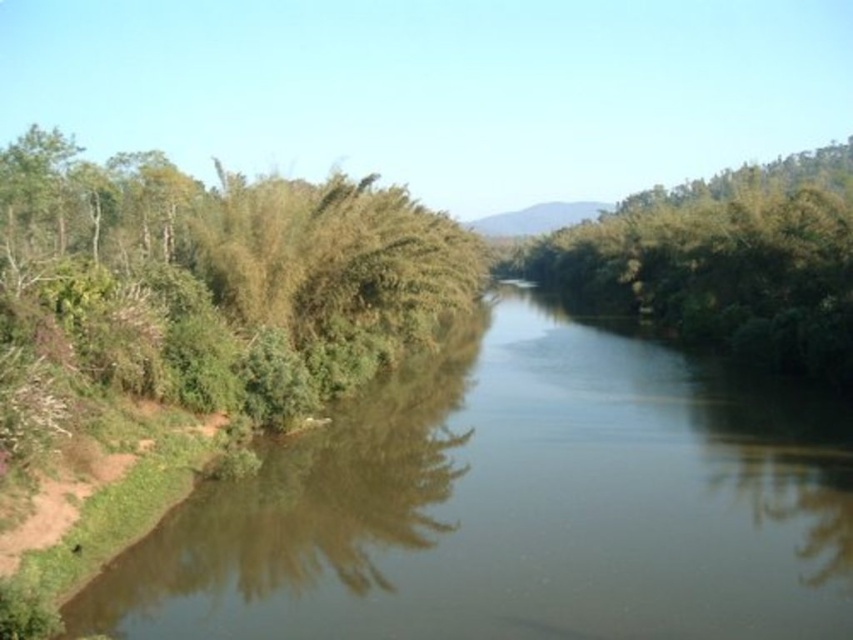
You are standing on the riverbank and see the green leafy river at left and the green leafy trees at center. Which object is positioned more to the left?

The green leafy river at left is positioned more to the left than the green leafy trees at center.

You are standing at the edge of the green leafy river at left and want to walk to the green leafy trees at center. Which direction should you head towards to get there?

The green leafy river at left is thinner than the green leafy trees at center, so you should head towards the center where the trees are wider.